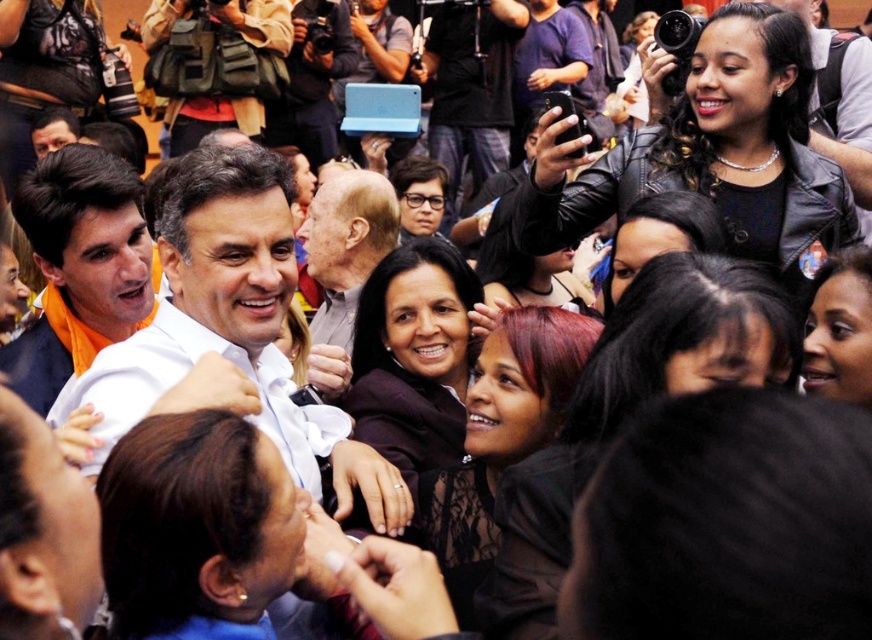
Question: Which of the following is the farthest from the observer?

Choices:
 (A) dark skin smooth face at center
 (B) white fabric shirt at left
 (C) dark brown fabric at center

Answer: (C)

Question: Which of these objects is positioned closest to the white fabric shirt at left?

Choices:
 (A) dark skin smooth face at center
 (B) black leather jacket at upper right
 (C) dark red hair at center

Answer: (C)

Question: Is dark red hair at center below gray hair at center?

Choices:
 (A) no
 (B) yes

Answer: (B)

Question: Which point appears farthest from the camera in this image?

Choices:
 (A) (336, 211)
 (B) (220, 282)

Answer: (A)

Question: Is black leather jacket at upper right to the left of dark brown fabric at center from the viewer's perspective?

Choices:
 (A) no
 (B) yes

Answer: (A)

Question: Does white shirt at center have a larger size compared to gray hair at center?

Choices:
 (A) yes
 (B) no

Answer: (B)